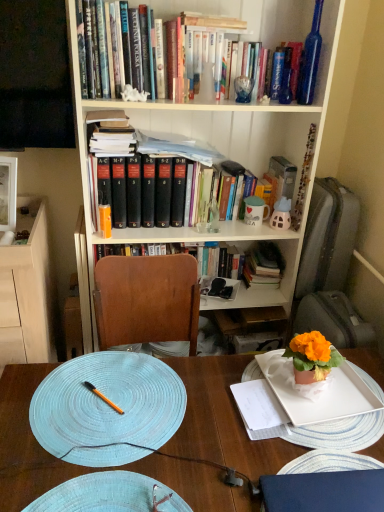
Identify the location of free location in front of white paper notebook at center. (252, 468).